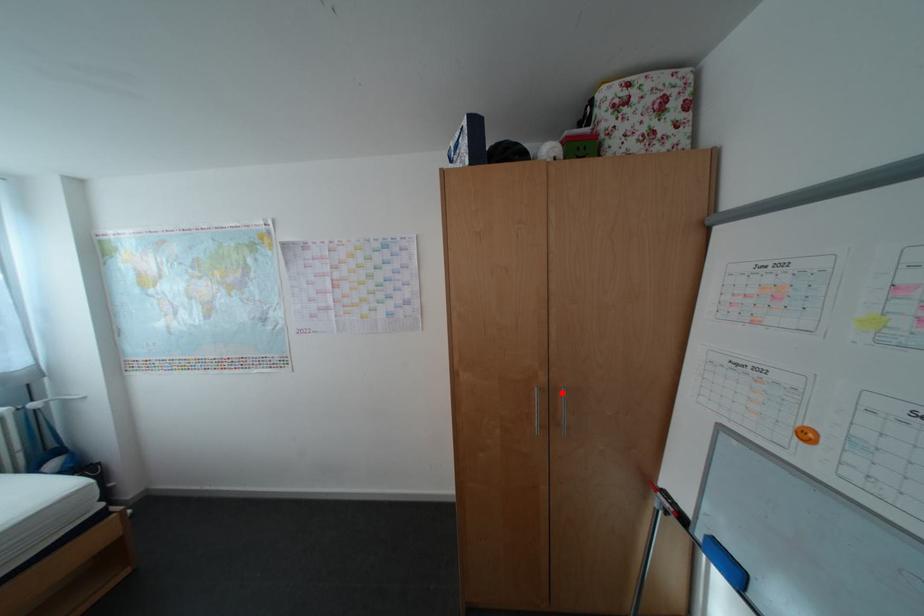
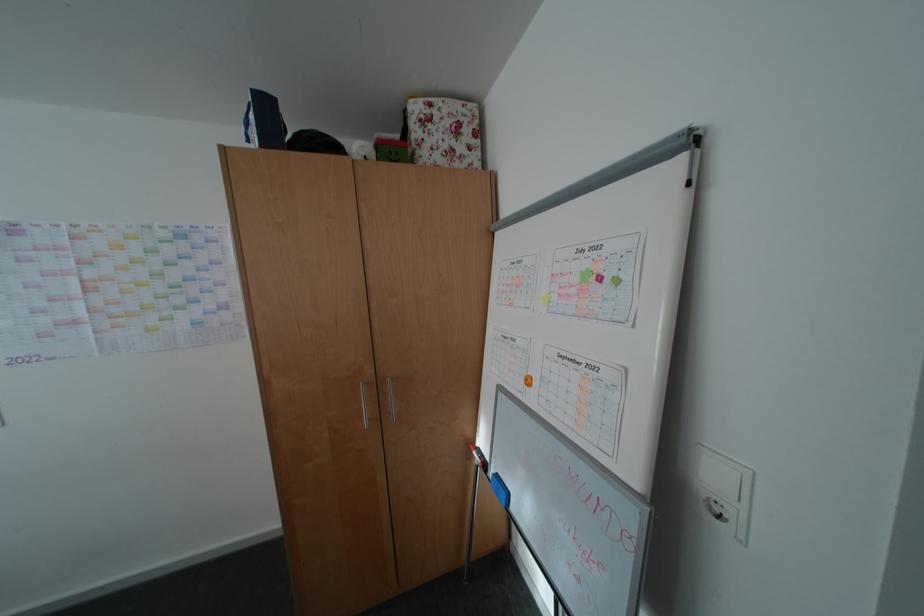
Where in the second image is the point corresponding to the highlighted location from the first image?

(390, 385)